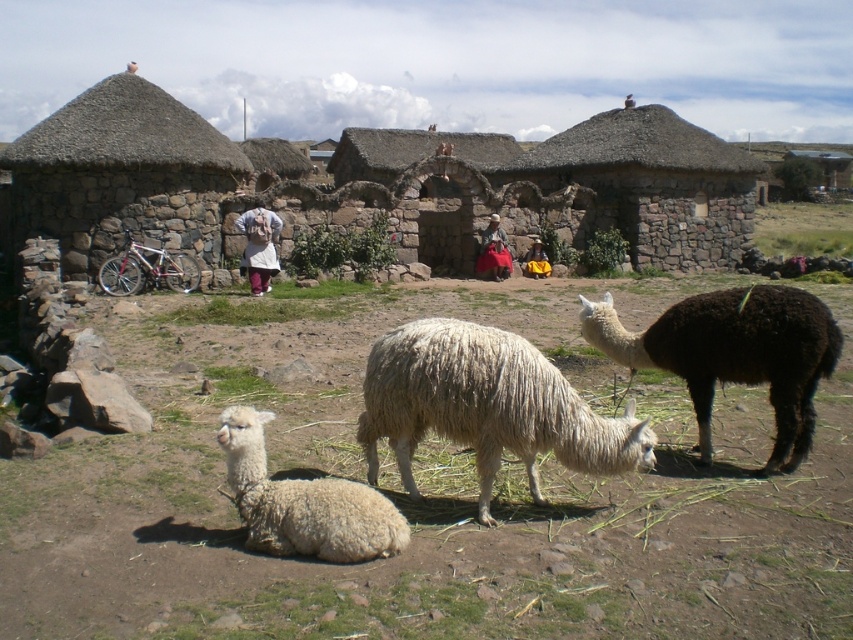
Question: Does white woolen sheep at lower left appear on the left side of white woolen sweater at center?

Choices:
 (A) no
 (B) yes

Answer: (A)

Question: Which point appears farthest from the camera in this image?

Choices:
 (A) (535, 275)
 (B) (494, 221)
 (C) (277, 221)
 (D) (820, 355)

Answer: (A)

Question: Considering the relative positions of white woolen sheep at lower left and white woolen sweater at center in the image provided, where is white woolen sheep at lower left located with respect to white woolen sweater at center?

Choices:
 (A) right
 (B) left

Answer: (A)

Question: Is black woolly alpaca at right smaller than white woolen sweater at center?

Choices:
 (A) yes
 (B) no

Answer: (B)

Question: Which object appears farthest from the camera in this image?

Choices:
 (A) yellow fabric at center
 (B) white woolen sheep at center
 (C) green soft grass at center

Answer: (A)

Question: Among these objects, which one is nearest to the camera?

Choices:
 (A) white woolen sweater at center
 (B) green soft grass at right
 (C) white woolen sheep at lower left
 (D) black woolly alpaca at right

Answer: (C)